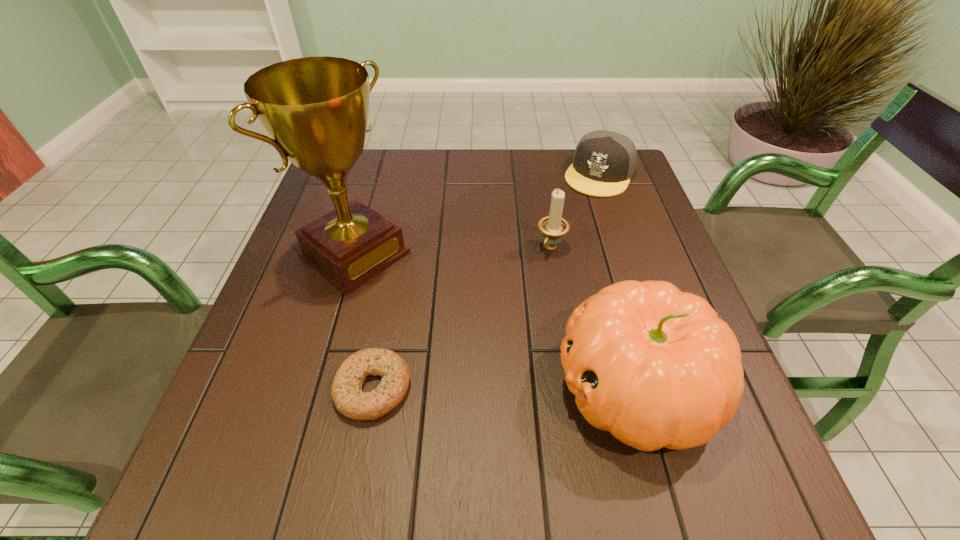
I want to click on free space at the right edge of the desktop, so [x=598, y=207].

Locate an element on the screen. vacant space at the far left corner is located at coordinates (375, 178).

Where is `free space at the near left corner of the desktop`? The width and height of the screenshot is (960, 540). free space at the near left corner of the desktop is located at coordinates (252, 393).

Image resolution: width=960 pixels, height=540 pixels. In order to click on vacant region between the bagel and the fourth tallest object in this screenshot , I will do `click(487, 281)`.

Find the location of a particular element. The image size is (960, 540). vacant area that lies between the pumpkin and the tallest object is located at coordinates (495, 320).

Where is `vacant space that is in between the pumpkin and the tallest object`? Image resolution: width=960 pixels, height=540 pixels. vacant space that is in between the pumpkin and the tallest object is located at coordinates (495, 320).

At what (x,y) coordinates should I click in order to perform the action: click on free spot between the second tallest object and the cap. Please return your answer as a coordinate pair (x, y). The height and width of the screenshot is (540, 960). Looking at the image, I should click on (617, 280).

The image size is (960, 540). Identify the location of free spot between the fourth shortest object and the bagel. (504, 387).

Locate an element on the screen. This screenshot has height=540, width=960. free space between the farthest object and the candle_holder is located at coordinates (575, 211).

This screenshot has height=540, width=960. I want to click on vacant area that lies between the award and the pumpkin, so click(495, 320).